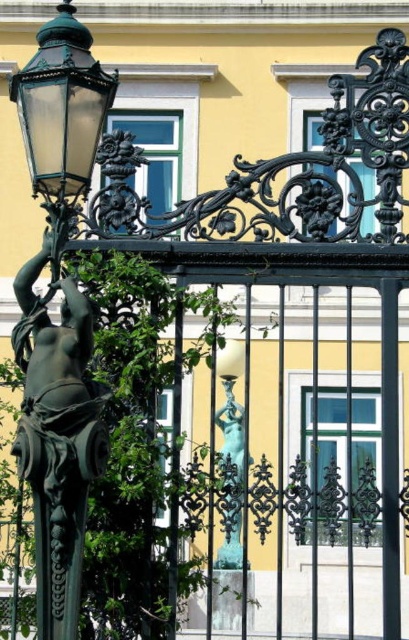
You are standing in front of the yellow building with white trim. You see the green glass streetlight at left and the shiny bronze statue at center. Which object is positioned to the left of the other?

The green glass streetlight at left is positioned to the left of the shiny bronze statue at center.

You are a city planner assessing the height of the green glass streetlight at left and the shiny bronze statue at center in the image. Which one is shorter?

The green glass streetlight at left is shorter than the shiny bronze statue at center.